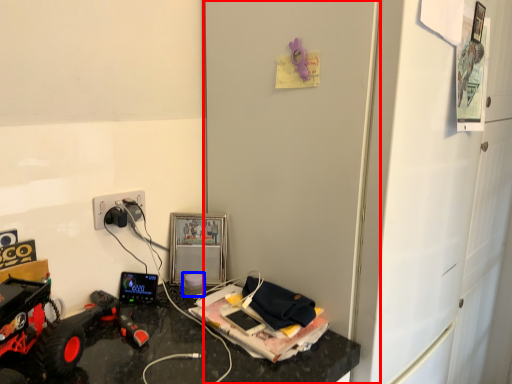
Question: Which point is closer to the camera, door (highlighted by a red box) or toy (highlighted by a blue box)?

Choices:
 (A) door
 (B) toy

Answer: (A)